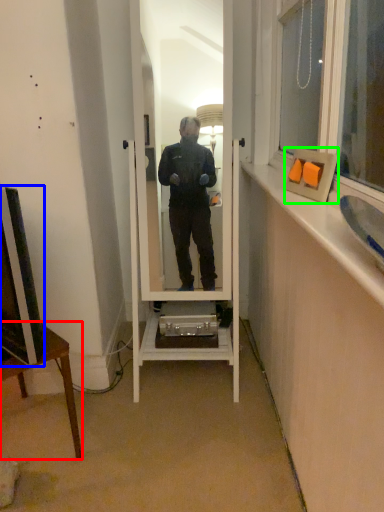
Question: Which object is positioned farthest from desk (highlighted by a red box)? Select from television (highlighted by a blue box) and picture frame (highlighted by a green box).

Choices:
 (A) television
 (B) picture frame

Answer: (B)